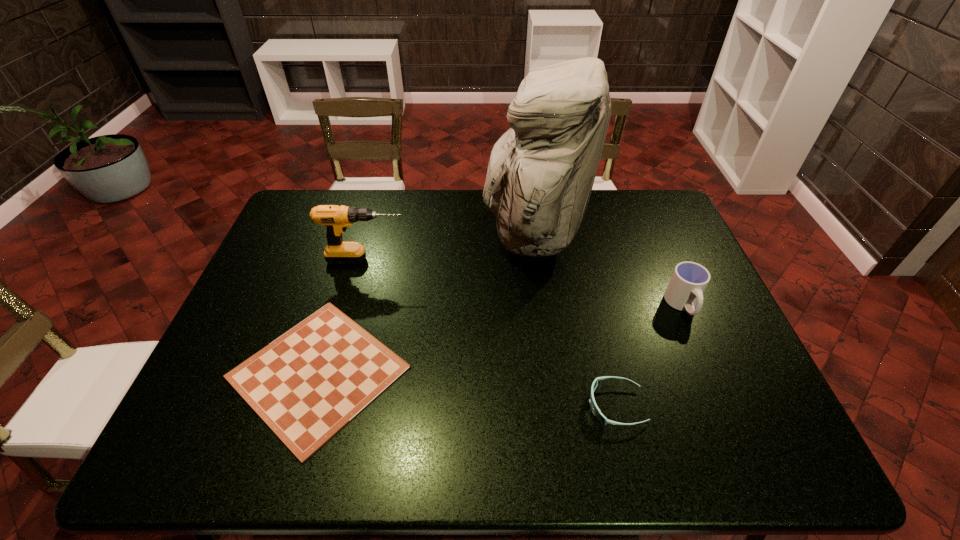
Locate an element on the screen. This screenshot has width=960, height=540. free space that satisfies the following two spatial constraints: 1. with the handle on the side of the cup; 2. on the front-facing side of the fourth tallest object is located at coordinates (726, 406).

The width and height of the screenshot is (960, 540). I want to click on vacant space that satisfies the following two spatial constraints: 1. with the handle on the side of the rightmost object; 2. on the front-facing side of the fourth tallest object, so click(x=726, y=406).